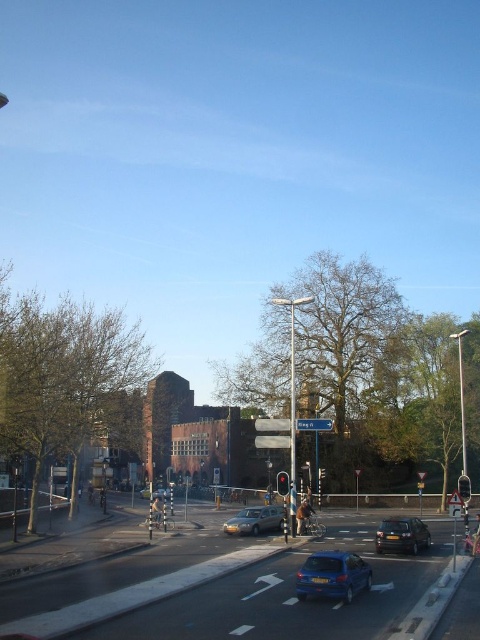
Describe the element at coordinates (402, 536) in the screenshot. I see `shiny black car at lower right` at that location.

Identify the location of shiny black car at lower right. The image size is (480, 640). (402, 536).

Which is in front, point (392, 541) or point (242, 531)?

Point (392, 541)

I want to click on shiny black car at lower right, so click(x=402, y=536).

Which is below, shiny black car at lower right or metallic traffic light at right?

shiny black car at lower right

Locate an element on the screen. The image size is (480, 640). shiny black car at lower right is located at coordinates (402, 536).

Does point (393, 522) lie in front of point (460, 490)?

No, (393, 522) is further to viewer.

This screenshot has height=640, width=480. I want to click on shiny black car at lower right, so click(402, 536).

Is point (362, 586) more distant than point (465, 490)?

No, it is not.

Is blue metallic hatchback at center smaller than metallic traffic light at right?

Indeed, blue metallic hatchback at center has a smaller size compared to metallic traffic light at right.

What are the coordinates of `blue metallic hatchback at center` in the screenshot? It's located at (333, 576).